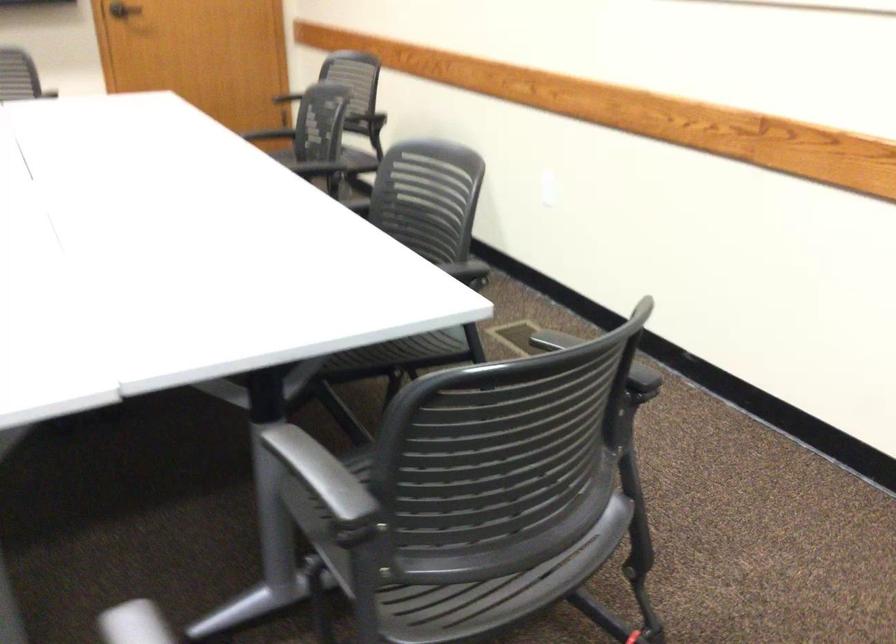
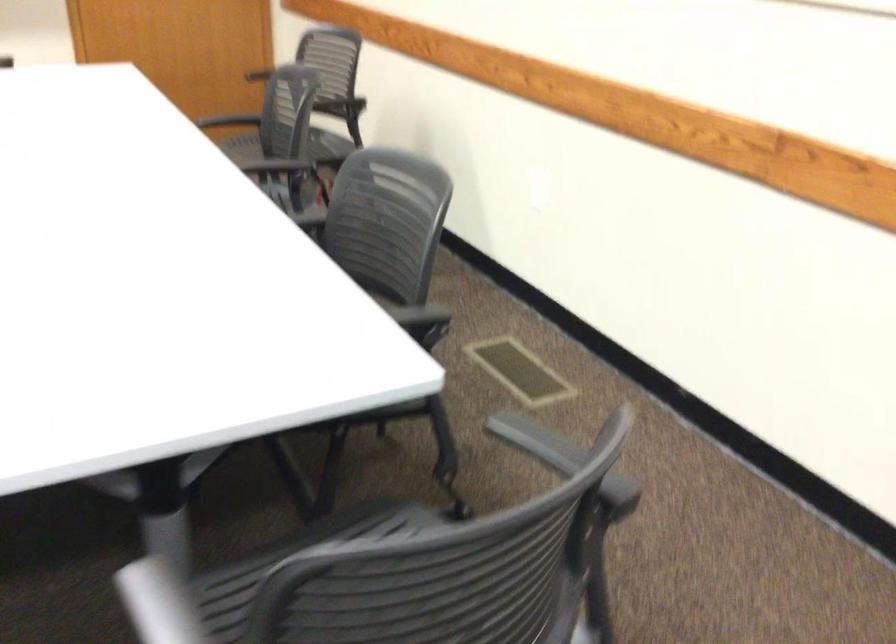
Where in the second image is the point corresponding to [286,453] from the first image?

(158, 603)